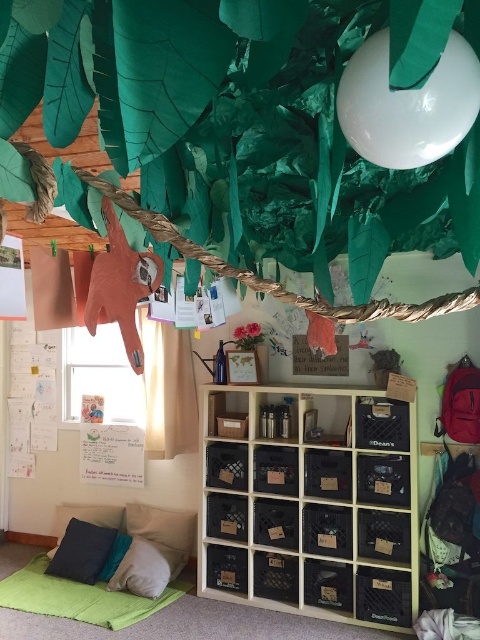
In the scene shown: Is dark gray cushion at lower left shorter than white soft pillow at lower left?

Incorrect, dark gray cushion at lower left's height does not fall short of white soft pillow at lower left's.

Who is more forward, (109, 552) or (113, 580)?

Positioned in front is point (113, 580).

I want to click on dark gray cushion at lower left, so click(82, 552).

Between black plastic crate at center and dark gray cushion at lower left, which one appears on the right side from the viewer's perspective?

black plastic crate at center is more to the right.

Between point (271, 531) and point (74, 536), which one is positioned in front?

Point (271, 531)

What are the coordinates of `black plastic crate at center` in the screenshot? It's located at (312, 504).

Is white soft pillow at lower left to the right of velvety blue pillow at lower left from the viewer's perspective?

Indeed, white soft pillow at lower left is positioned on the right side of velvety blue pillow at lower left.

Between point (170, 568) and point (59, 525), which one is positioned behind?

Positioned behind is point (59, 525).

Is point (141, 564) in front of point (86, 508)?

Yes.

Locate an element on the screen. Image resolution: width=480 pixels, height=640 pixels. white soft pillow at lower left is located at coordinates (145, 566).